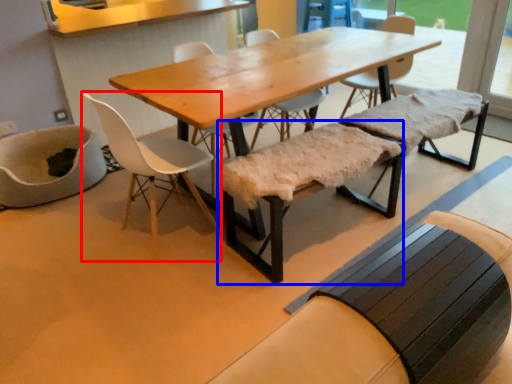
Question: Which point is further to the camera, chair (highlighted by a red box) or church bench (highlighted by a blue box)?

Choices:
 (A) chair
 (B) church bench

Answer: (B)